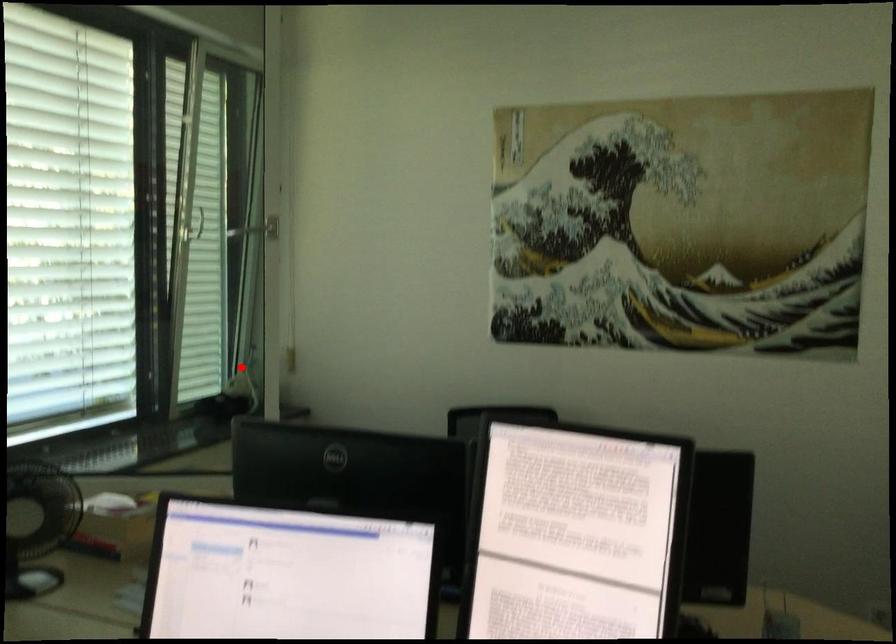
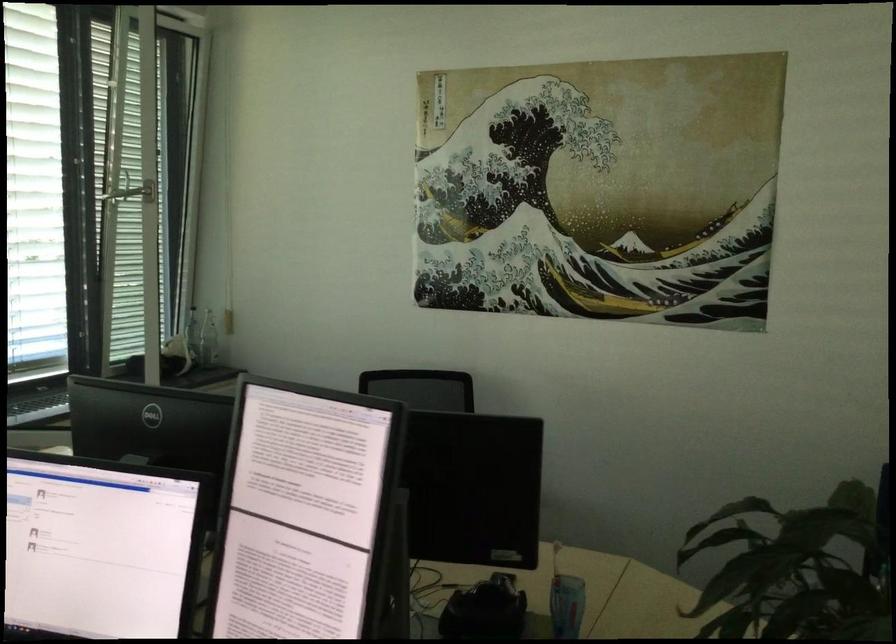
Where in the second image is the point corresponding to the highlighted location from the first image?

(192, 334)